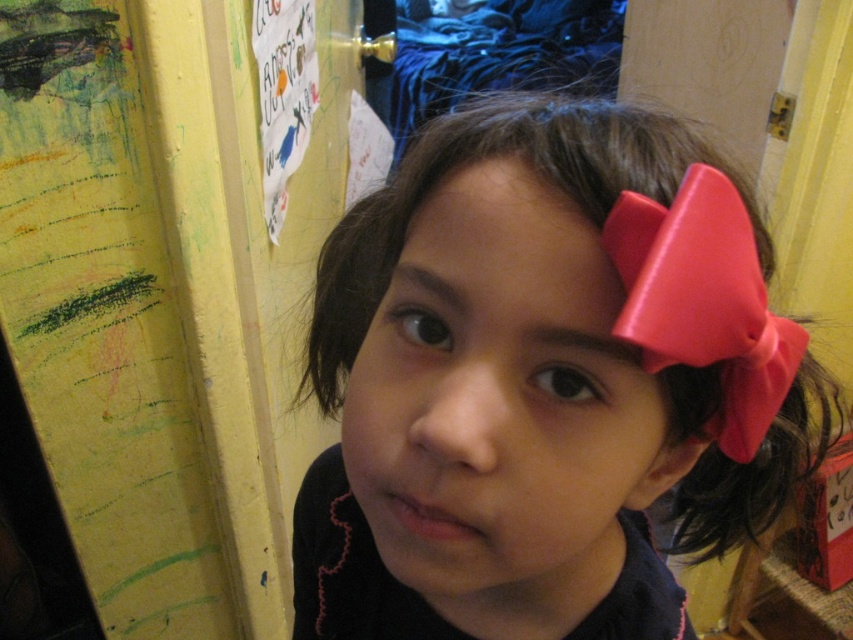
Question: Estimate the real-world distances between objects in this image. Which object is closer to the smooth skin at center?

Choices:
 (A) pink matte bow at center
 (B) pink satin bow at right

Answer: (B)

Question: Is pink matte bow at center below smooth skin at center?

Choices:
 (A) yes
 (B) no

Answer: (A)

Question: Is pink matte bow at center positioned in front of smooth skin at center?

Choices:
 (A) yes
 (B) no

Answer: (A)

Question: Is pink satin bow at right to the right of smooth skin at center from the viewer's perspective?

Choices:
 (A) yes
 (B) no

Answer: (A)

Question: Which object is positioned closest to the smooth skin at center?

Choices:
 (A) pink matte bow at center
 (B) pink satin bow at right

Answer: (B)

Question: Which point is closer to the camera?

Choices:
 (A) (712, 342)
 (B) (505, 269)

Answer: (A)